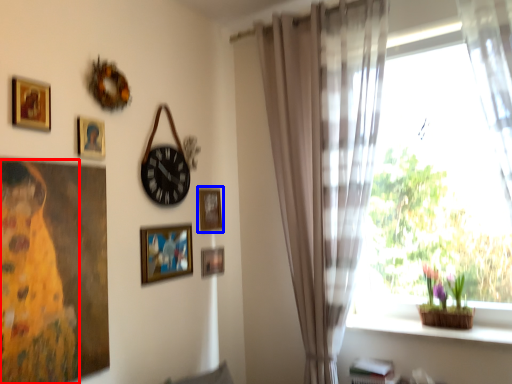
Question: Which object is further to the camera taking this photo, woman (highlighted by a red box) or picture frame (highlighted by a blue box)?

Choices:
 (A) woman
 (B) picture frame

Answer: (B)